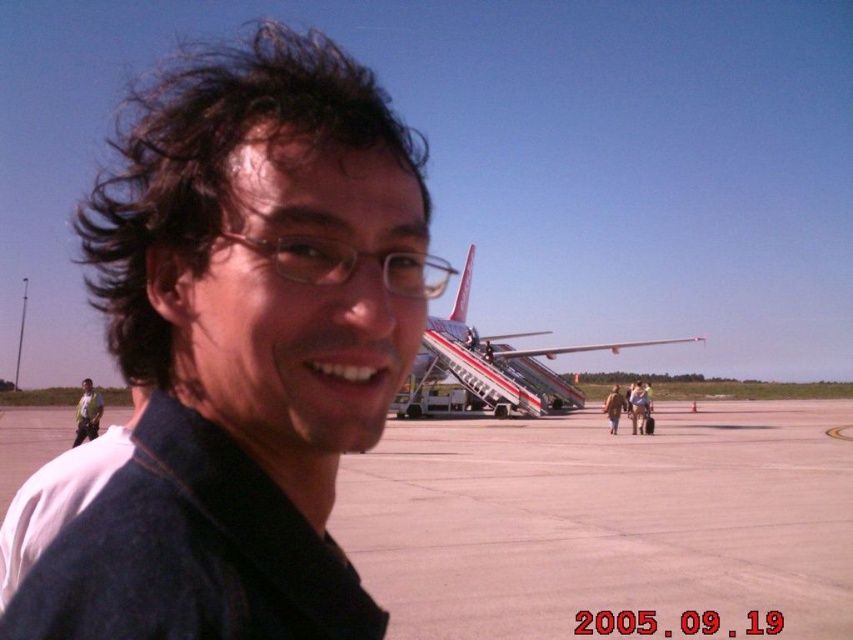
Between point (10, 602) and point (514, 605), which one is positioned behind?

The point (514, 605) is more distant.

Find the location of `dark blue shirt at center`. dark blue shirt at center is located at coordinates (242, 348).

Is point (480, 561) positioned behind point (77, 428)?

No, it is not.

Does smooth concrete tarmac at center come in front of matte black shirt at left?

Yes, it is.

Who is more forward, (798, 486) or (80, 426)?

Positioned in front is point (798, 486).

You are a GUI agent. You are given a task and a screenshot of the screen. Output one action in this format:
    pyautogui.click(x=<x>, y=<y>)
    Task: Click on the smooth concrete tarmac at center
    This screenshot has height=640, width=853.
    Given the screenshot: What is the action you would take?
    pyautogui.click(x=605, y=520)

Which is more to the left, white painted fuselage at center or matte black shirt at left?

matte black shirt at left

Can you confirm if white painted fuselage at center is shorter than matte black shirt at left?

No.

Does point (498, 344) lie in front of point (90, 433)?

No, (498, 344) is behind (90, 433).

Where is `white painted fuselage at center`? white painted fuselage at center is located at coordinates (494, 364).